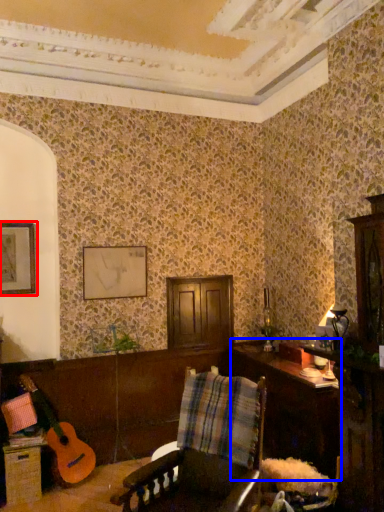
Question: Which of the following is the closest to the observer, picture frame (highlighted by a red box) or table (highlighted by a blue box)?

Choices:
 (A) picture frame
 (B) table

Answer: (B)